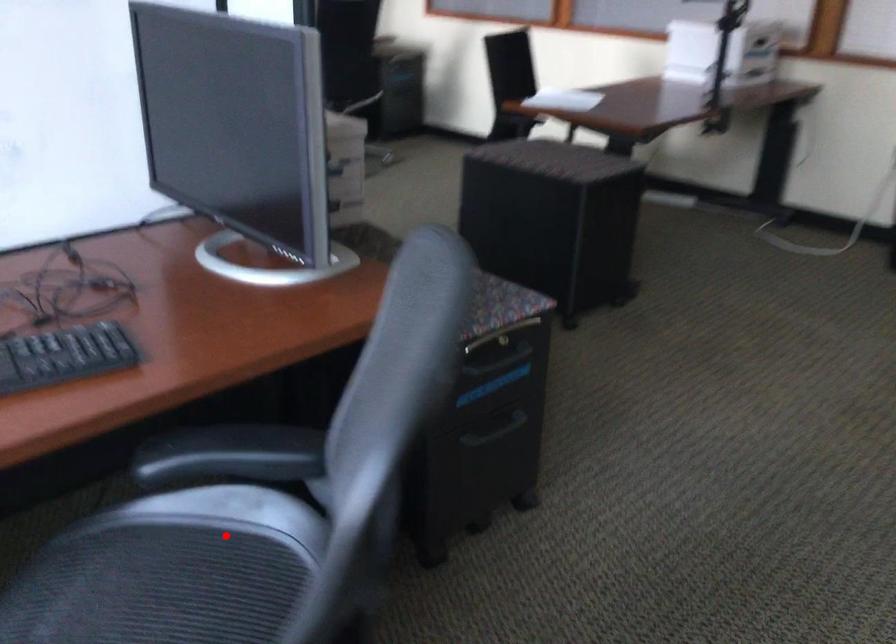
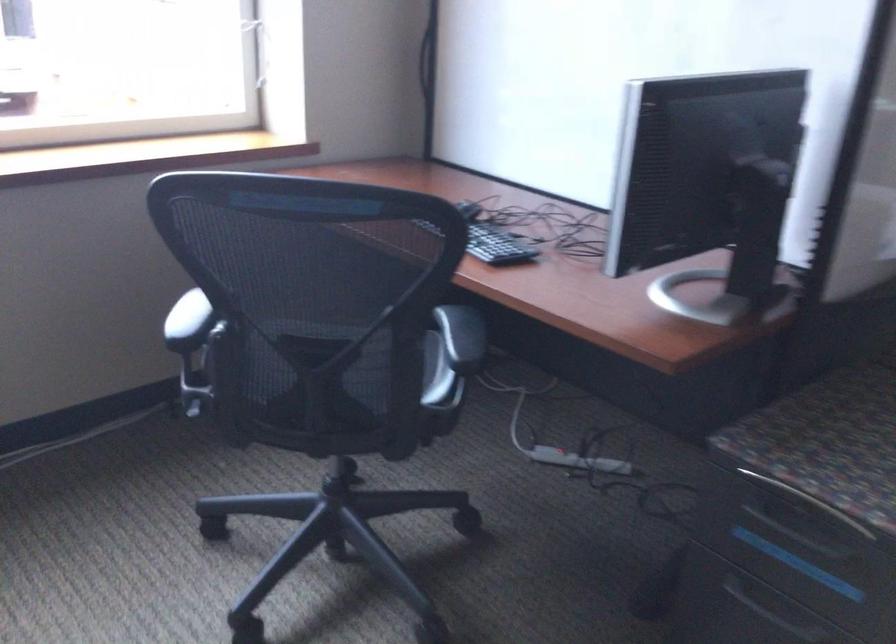
Where in the second image is the point corresponding to the highlighted location from the first image?

(435, 373)